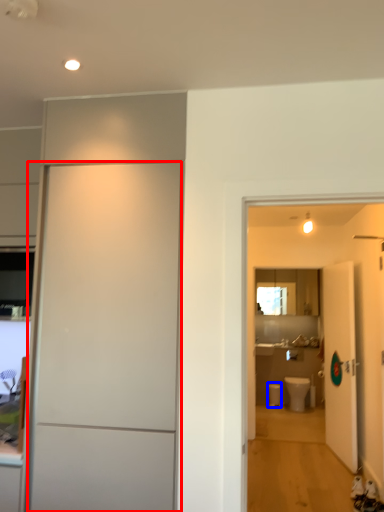
Question: Which object appears farthest to the camera in this image, door (highlighted by a red box) or toilet bowl (highlighted by a blue box)?

Choices:
 (A) door
 (B) toilet bowl

Answer: (B)